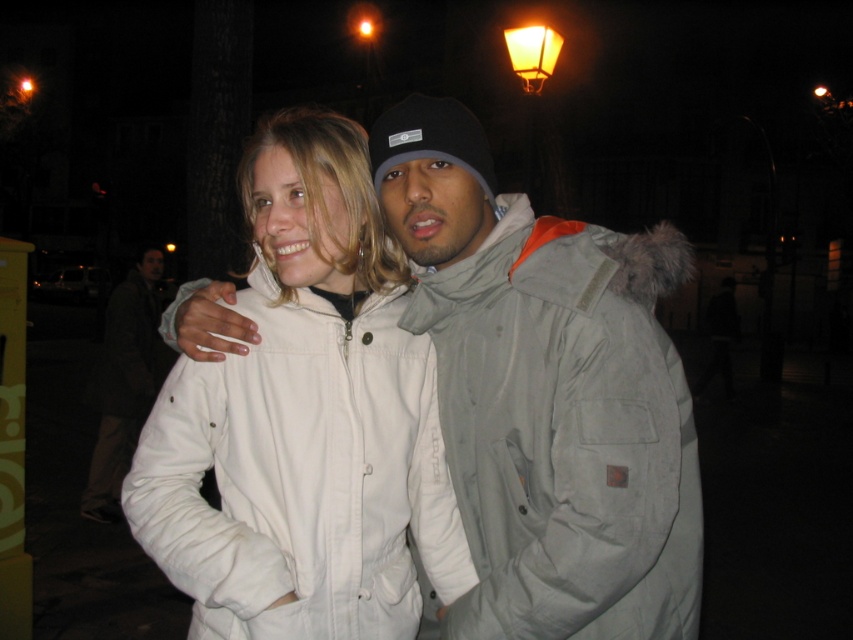
You are a photographer trying to capture the scene with the white matte jacket at center and the orange frosted glass streetlamp at upper right. Based on their positions, which object would appear closer to the bottom of the photo?

The white matte jacket at center appears closer to the bottom of the photo because it is positioned below the orange frosted glass streetlamp at upper right.

You are a photographer trying to capture the gray fabric jacket at center in the image. What coordinates should you aim for to ensure the jacket is centered in your shot?

The gray fabric jacket at center is located at coordinates point (547, 394), so you should aim for those coordinates to center it in your shot.